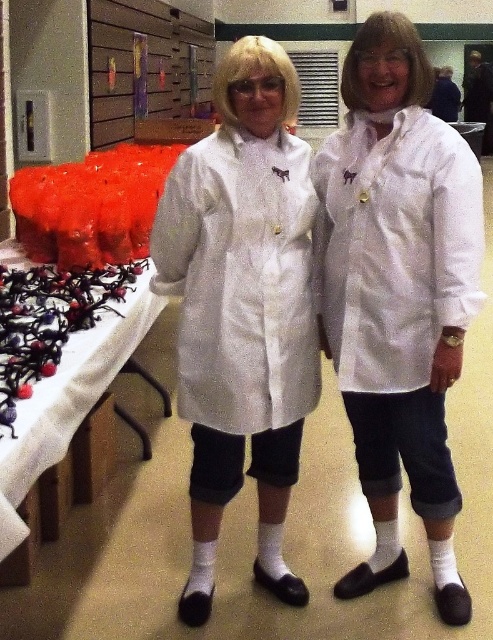
Who is more distant from viewer, (432, 198) or (12, 513)?

Positioned behind is point (432, 198).

Does white textured coat at center appear on the left side of white fabric table at lower left?

Incorrect, white textured coat at center is not on the left side of white fabric table at lower left.

Describe the element at coordinates (394, 246) in the screenshot. This screenshot has width=493, height=640. I see `white textured coat at center` at that location.

Locate an element on the screen. white textured coat at center is located at coordinates (394, 246).

Does white fabric lab coat at center have a lesser height compared to white textured lab coat at center?

Incorrect, white fabric lab coat at center's height does not fall short of white textured lab coat at center's.

This screenshot has width=493, height=640. What are the coordinates of `white fabric lab coat at center` in the screenshot? It's located at (397, 292).

Is point (379, 65) closer to camera compared to point (234, 308)?

Yes, it is.

Where is `white fabric lab coat at center`? The width and height of the screenshot is (493, 640). white fabric lab coat at center is located at coordinates (397, 292).

Which is in front, point (288, 369) or point (389, 330)?

Positioned in front is point (389, 330).

Image resolution: width=493 pixels, height=640 pixels. Identify the location of white textured lab coat at center. (241, 280).

This screenshot has height=640, width=493. I want to click on white textured lab coat at center, so click(x=241, y=280).